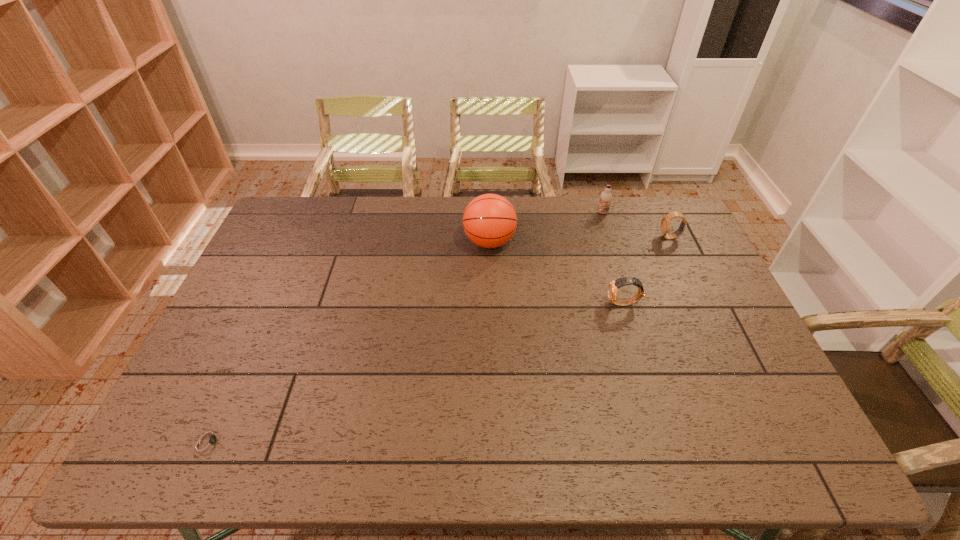
In the image, there is a desktop. At what (x,y) coordinates should I click in order to perform the action: click on free region at the far right corner. Please return your answer as a coordinate pair (x, y). Looking at the image, I should click on (639, 199).

Where is `empty location between the rightmost object and the fourth farthest object`? empty location between the rightmost object and the fourth farthest object is located at coordinates (646, 271).

This screenshot has width=960, height=540. I want to click on unoccupied position between the second nearest watch and the chocolate milk, so click(612, 258).

You are a GUI agent. You are given a task and a screenshot of the screen. Output one action in this format:
    pyautogui.click(x=<x>, y=<y>)
    Task: Click on the free spot between the second farthest watch and the nearest watch
    
    Given the screenshot: What is the action you would take?
    pyautogui.click(x=416, y=372)

The width and height of the screenshot is (960, 540). I want to click on vacant area that lies between the shortest watch and the chocolate milk, so click(x=405, y=327).

Identify the location of vacant area between the shortest object and the farthest object. (405, 327).

Where is `vacant space that's between the farthest object and the rightmost watch`? vacant space that's between the farthest object and the rightmost watch is located at coordinates (636, 225).

You are a GUI agent. You are given a task and a screenshot of the screen. Output one action in this format:
    pyautogui.click(x=<x>, y=<y>)
    Task: Click on the unoccupied position between the second nearest object and the leftmost object
    
    Given the screenshot: What is the action you would take?
    pyautogui.click(x=416, y=372)

Locate an element on the screen. The image size is (960, 540). vacant space that's between the chocolate milk and the rightmost object is located at coordinates (636, 225).

At what (x,y) coordinates should I click in order to perform the action: click on free space between the tallest object and the fourth farthest object. Please return your answer as a coordinate pair (x, y). This screenshot has width=960, height=540. Looking at the image, I should click on (557, 273).